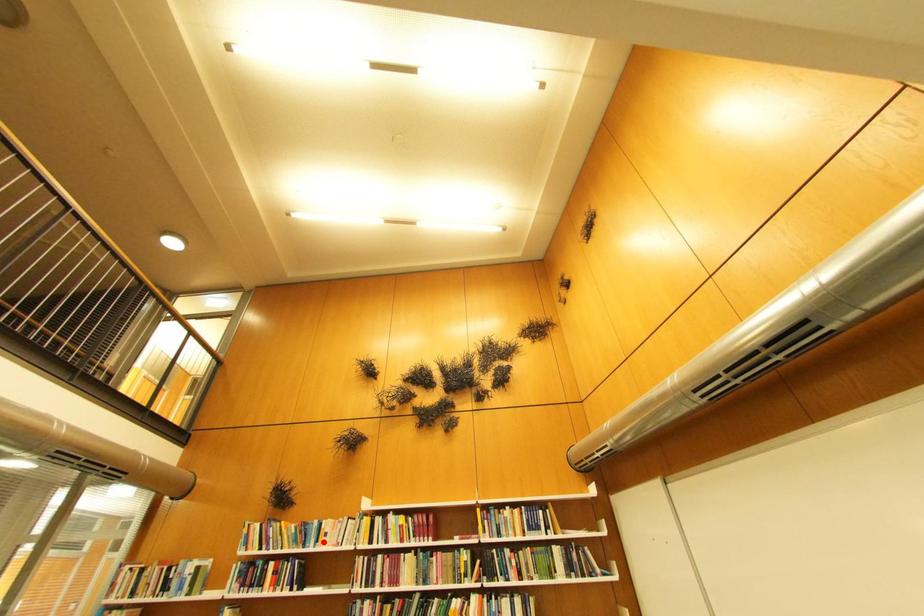
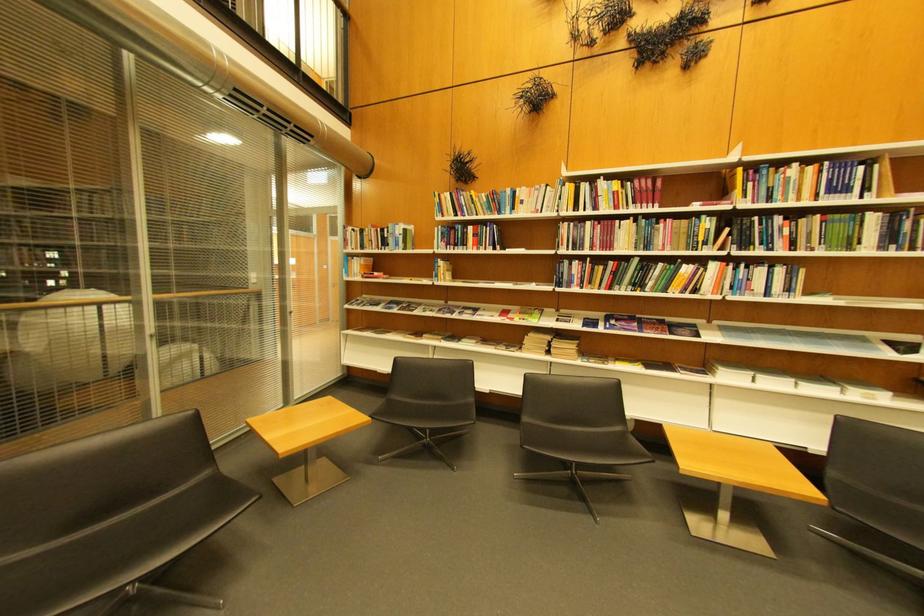
Question: I am providing you with two images of the same scene from different viewpoints. A red point is shown in image1. For the corresponding object point in image2, is it positioned nearer or farther from the camera?

Choices:
 (A) Nearer
 (B) Farther

Answer: (A)